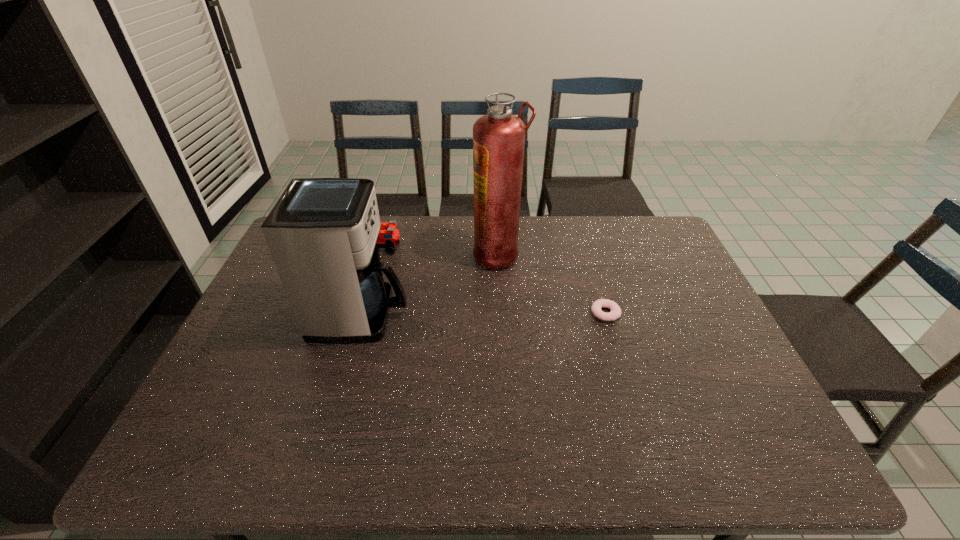
Where is `empty space between the second shortest object and the rightmost object`? Image resolution: width=960 pixels, height=540 pixels. empty space between the second shortest object and the rightmost object is located at coordinates (495, 280).

Find the location of `free spot between the tallest object and the shortest object`. free spot between the tallest object and the shortest object is located at coordinates (552, 284).

Where is `vacant space that's between the tallest object and the coffee maker`? The width and height of the screenshot is (960, 540). vacant space that's between the tallest object and the coffee maker is located at coordinates (430, 285).

Where is `free space between the rightmost object and the Lego`? The height and width of the screenshot is (540, 960). free space between the rightmost object and the Lego is located at coordinates (495, 280).

The width and height of the screenshot is (960, 540). What are the coordinates of `empty space between the Lego and the second object from right to left` in the screenshot? It's located at (443, 252).

This screenshot has height=540, width=960. Identify the location of vacant space that's between the shortest object and the third object from left to right. (552, 284).

The width and height of the screenshot is (960, 540). Find the location of `free spot between the second object from right to left and the third tallest object`. free spot between the second object from right to left and the third tallest object is located at coordinates (443, 252).

This screenshot has height=540, width=960. What are the coordinates of `vacant space that's between the shortest object and the second shortest object` in the screenshot? It's located at (495, 280).

In order to click on unoccupied position between the doughnut and the third tallest object in this screenshot , I will do `click(495, 280)`.

Locate an element on the screen. object that is the third closest to the second object from right to left is located at coordinates (389, 236).